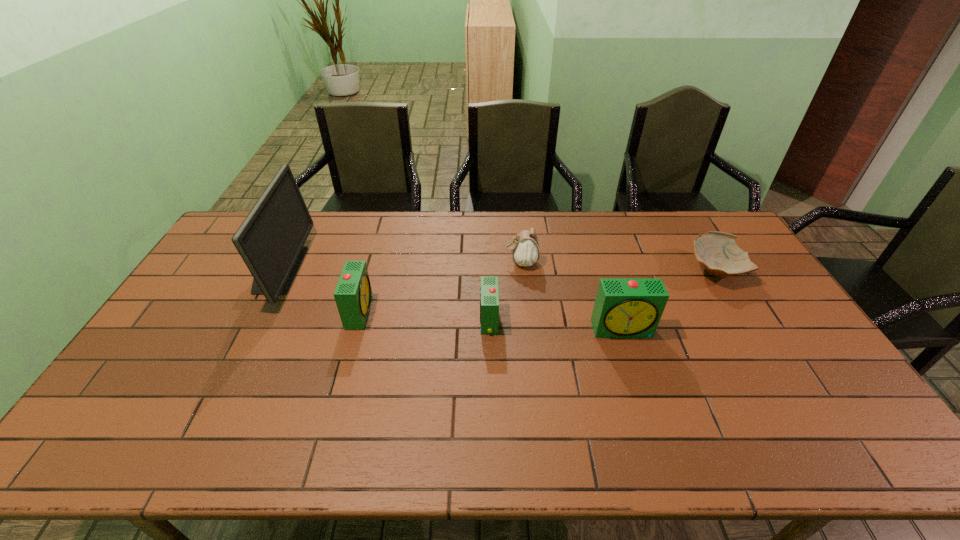
Locate an element on the screen. the second tallest alarm clock is located at coordinates (353, 294).

Where is `the leftmost alarm clock`? the leftmost alarm clock is located at coordinates (353, 294).

Where is `the second alarm clock from right to left`? the second alarm clock from right to left is located at coordinates (489, 294).

Identify the location of the shortest alarm clock. (489, 294).

Locate an element on the screen. the second object from right to left is located at coordinates (624, 307).

In order to click on computer monitor in this screenshot , I will do `click(271, 239)`.

The width and height of the screenshot is (960, 540). What are the coordinates of `the tallest object` in the screenshot? It's located at (271, 239).

This screenshot has width=960, height=540. Identify the location of the shortest object. click(718, 252).

Where is `pottery`? pottery is located at coordinates (718, 252).

The width and height of the screenshot is (960, 540). I want to click on pouch, so click(525, 247).